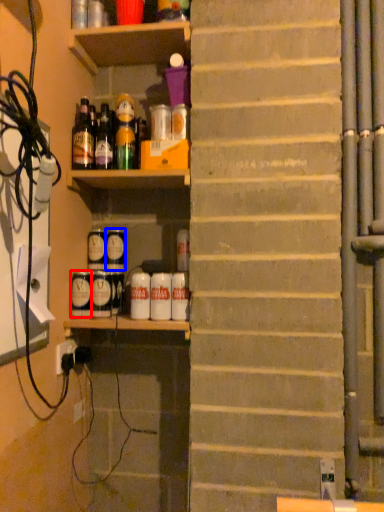
Question: Which point is further to the camera, beverage (highlighted by a red box) or beverage (highlighted by a blue box)?

Choices:
 (A) beverage
 (B) beverage

Answer: (B)